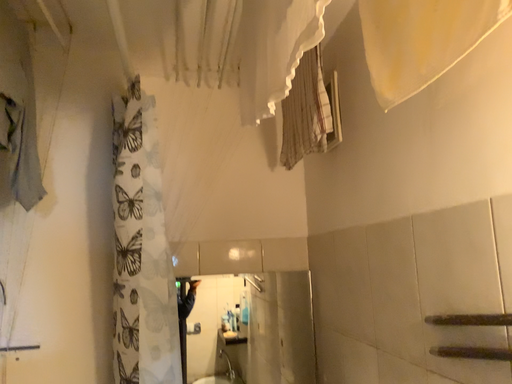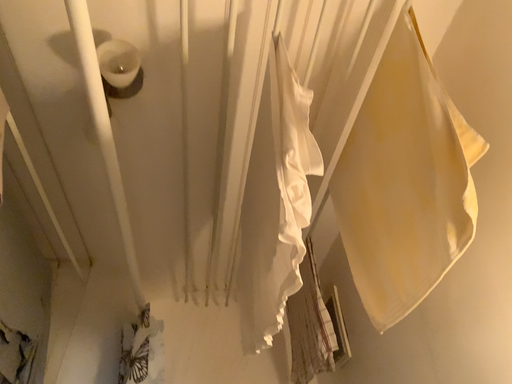
Question: How did the camera likely rotate when shooting the video?

Choices:
 (A) rotated downward
 (B) rotated upward

Answer: (B)